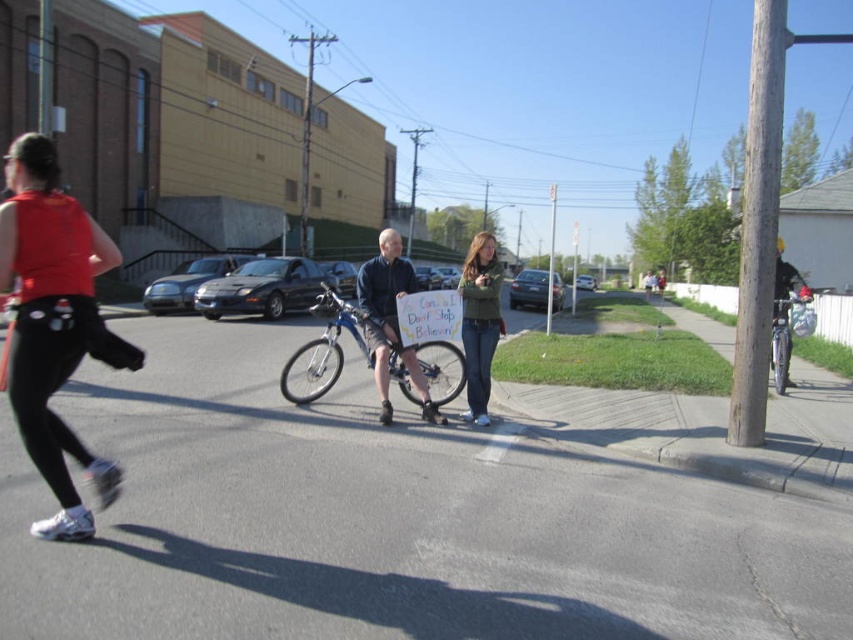
Based on the photo, you are a delivery person who needs to quickly reach the blue metallic bicycle at center. There is a person in a matte red tank top at left blocking your path. Can you go around them to reach the bicycle?

The matte red tank top at left is to the left of the blue metallic bicycle at center, so you can go around to the right side of the matte red tank top at left to reach the bicycle.

You are a delivery person who needs to load both the blue metallic bicycle at center and the green fuzzy sweater at center into your van. Given that the van has a height restriction of 1.2 meters, can both items be placed vertically without exceeding the limit?

The blue metallic bicycle at center has a lesser height compared to green fuzzy sweater at center. Since the green fuzzy sweater at center is taller than the bicycle, and the van has a 1.2 meters height restriction, both items can be placed vertically only if the green fuzzy sweater at center is under 1.2 meters. However, without knowing the exact height of the sweater, we cannot confirm if both will fit.

You are a delivery person who needs to park your blue metallic bicycle at center near a parking spot located at coordinates 0.542, 0.383. Can you confirm if the bicycle is already positioned correctly?

The blue metallic bicycle at center is already positioned at point (326, 346), so it is correctly parked at the desired location.